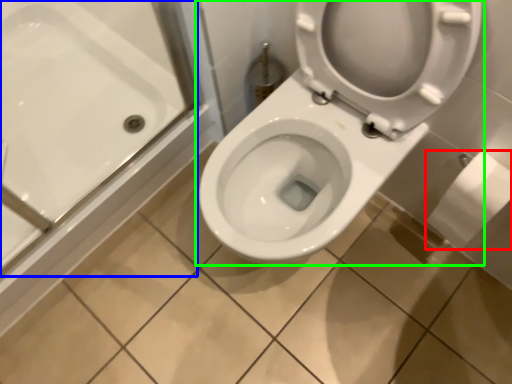
Question: Which is nearer to the toilet paper (highlighted by a red box)? bath (highlighted by a blue box) or toilet (highlighted by a green box).

Choices:
 (A) bath
 (B) toilet

Answer: (B)